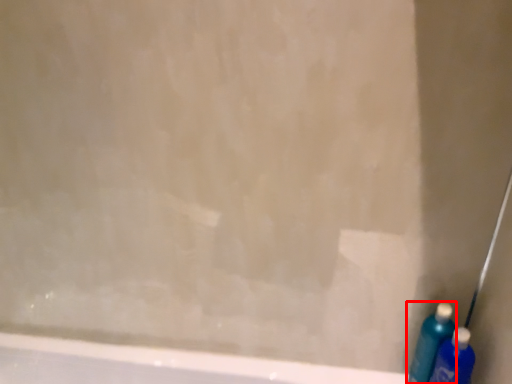
Question: From the image's perspective, where is cleaning product (annotated by the red box) located relative to cleaning product?

Choices:
 (A) above
 (B) below

Answer: (A)